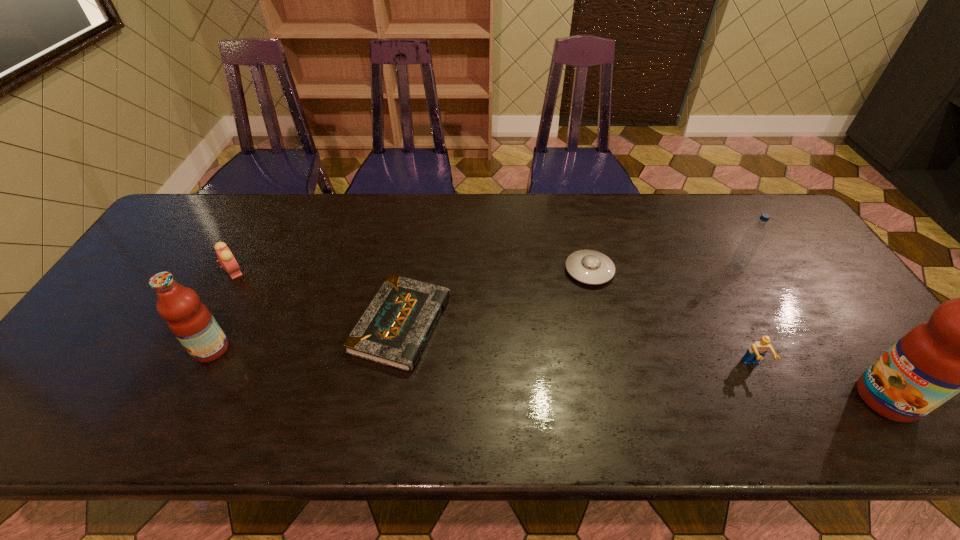
Please point a space for a new fruit_juice to maintain equal intervals. Please provide its 2D coordinates. Your answer should be formatted as a tuple, i.e. [(x, y)], where the tuple contains the x and y coordinates of a point satisfying the conditions above.

[(534, 373)]